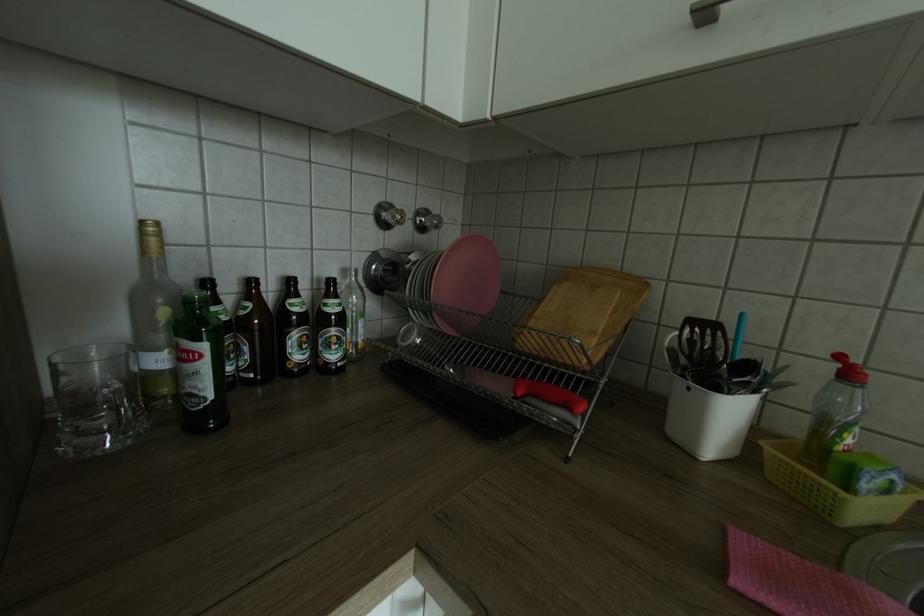
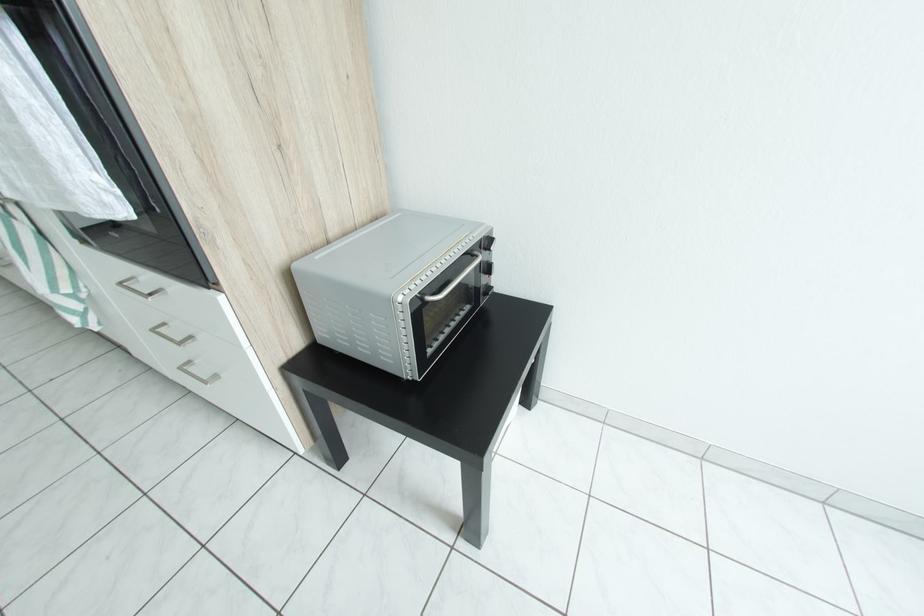
Looking at this image, which direction would the cameraman need to move to produce the second image?

The cameraman moved toward right, backward.